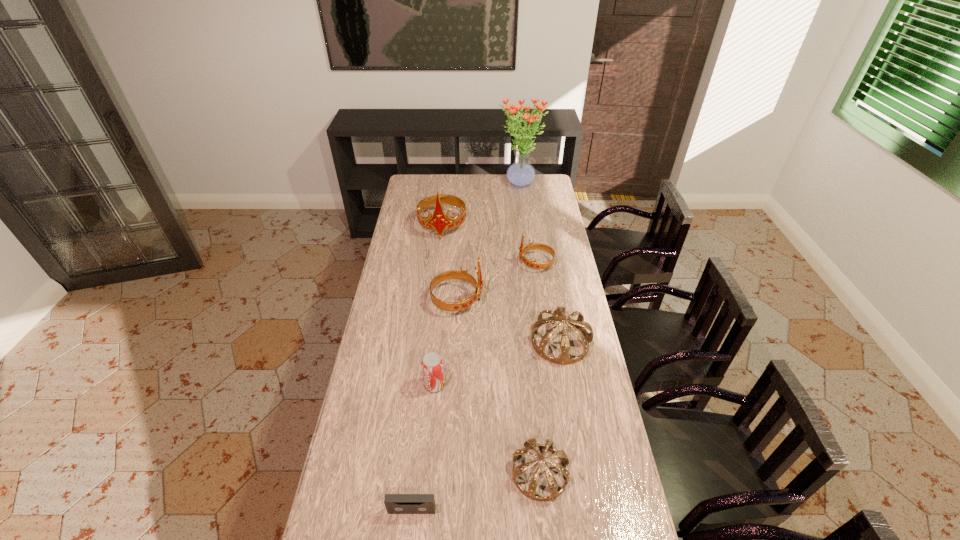
Where is `red soda can`? The width and height of the screenshot is (960, 540). red soda can is located at coordinates (432, 365).

Locate an element on the screen. The width and height of the screenshot is (960, 540). the sixth farthest object is located at coordinates (432, 365).

The height and width of the screenshot is (540, 960). Identify the location of the nearest tiara. (531, 443).

Locate an element on the screen. This screenshot has width=960, height=540. the smaller brown tiara is located at coordinates (531, 443).

Image resolution: width=960 pixels, height=540 pixels. In order to click on the nearest object in this screenshot , I will do `click(395, 503)`.

This screenshot has height=540, width=960. Identify the location of the shortest object. (395, 503).

You are a GUI agent. You are given a task and a screenshot of the screen. Output one action in this format:
    pyautogui.click(x=<x>, y=<y>)
    Task: Click on the free location located 0.070m on the front of the red flower arrangement
    
    Given the screenshot: What is the action you would take?
    pyautogui.click(x=522, y=203)

Locate an element on the screen. This screenshot has width=960, height=540. free region located 0.060m on the front-facing side of the tallest tiara is located at coordinates (440, 250).

At what (x,y) coordinates should I click in order to perform the action: click on vacant point located 0.260m on the front-facing side of the sixth shortest object. Please return your answer as a coordinate pair (x, y). Image resolution: width=960 pixels, height=540 pixels. Looking at the image, I should click on (545, 300).

Find the location of a particular element. free space located 0.070m on the front-facing side of the smallest red tiara is located at coordinates (503, 264).